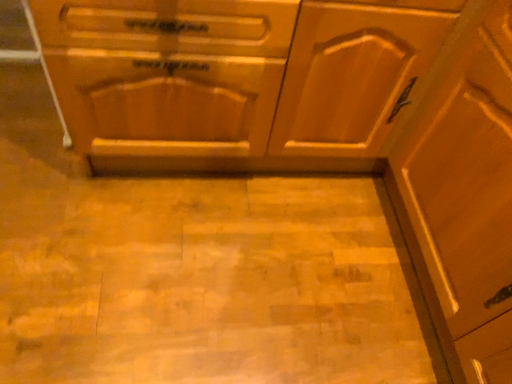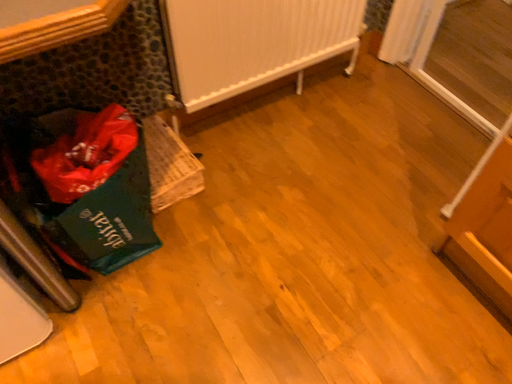
Question: Which way did the camera rotate in the video?

Choices:
 (A) rotated downward
 (B) rotated upward

Answer: (B)